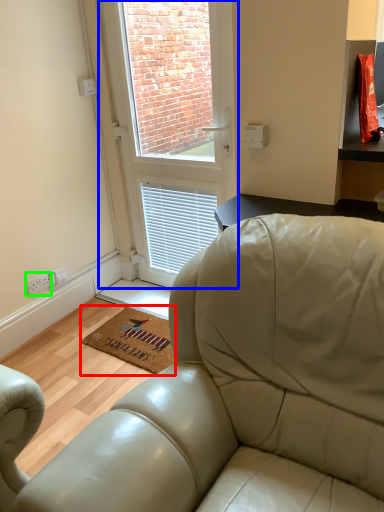
Question: Estimate the real-world distances between objects in this image. Which object is farther from mat (highlighted by a red box), window (highlighted by a blue box) or electric outlet (highlighted by a green box)?

Choices:
 (A) window
 (B) electric outlet

Answer: (A)